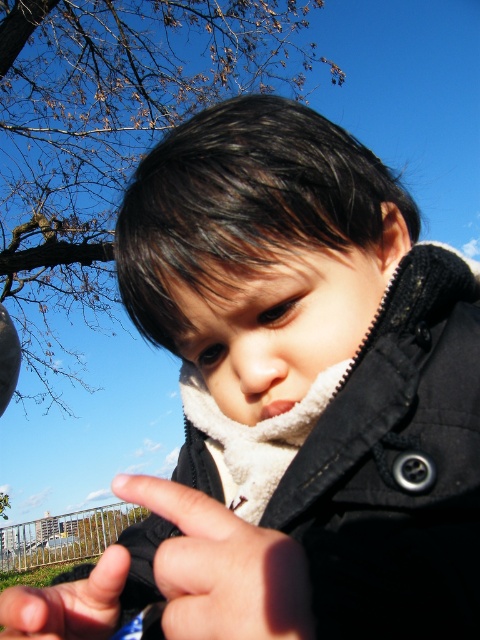
The child in the image is holding an object. You need to determine if the smooth black glove at center is covering the entire smooth black hand at center. Based on the provided information, can you confirm this?

The smooth black glove at center is not as tall as the smooth black hand at center, so it does not cover the entire hand.

You are a photographer trying to capture the child in the image. You notice the smooth black glove at center and the smooth black hand at center. Which object is positioned to the right side of the other?

The smooth black glove at center is to the right of the smooth black hand at center.

The child in the image is holding something in their hand. You need to determine if the smooth black glove at center can fully cover the smooth black hand at center. Based on the spatial relationship between them, what is your conclusion?

The smooth black glove at center occupies less space than the smooth black hand at center, so it cannot fully cover the hand.